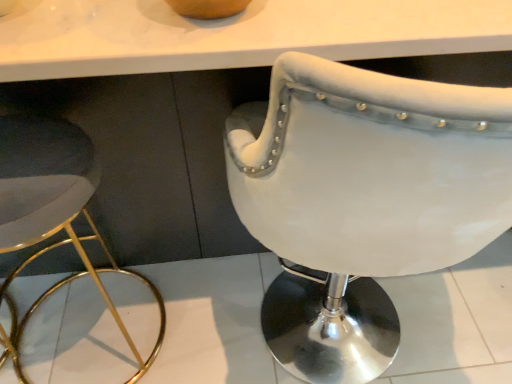
Question: Is white leather stool at left aimed at white leather chair at center?

Choices:
 (A) yes
 (B) no

Answer: (B)

Question: Considering the relative sizes of white leather stool at left and white leather chair at center in the image provided, is white leather stool at left wider than white leather chair at center?

Choices:
 (A) yes
 (B) no

Answer: (B)

Question: Is white leather chair at center located within white leather stool at left?

Choices:
 (A) yes
 (B) no

Answer: (B)

Question: Is white leather stool at left directly adjacent to white leather chair at center?

Choices:
 (A) yes
 (B) no

Answer: (B)

Question: Is white leather stool at left turned away from white leather chair at center?

Choices:
 (A) no
 (B) yes

Answer: (A)

Question: Can we say white leather stool at left lies outside white leather chair at center?

Choices:
 (A) no
 (B) yes

Answer: (B)

Question: Can you confirm if white leather chair at center is thinner than white leather stool at left?

Choices:
 (A) yes
 (B) no

Answer: (B)

Question: From a real-world perspective, is white leather chair at center on white leather stool at left?

Choices:
 (A) yes
 (B) no

Answer: (A)

Question: Does white leather chair at center have a greater width compared to white leather stool at left?

Choices:
 (A) no
 (B) yes

Answer: (B)

Question: Does white leather chair at center appear on the right side of white leather stool at left?

Choices:
 (A) no
 (B) yes

Answer: (B)

Question: Is white leather chair at center smaller than white leather stool at left?

Choices:
 (A) yes
 (B) no

Answer: (B)

Question: Is white leather stool at left completely or partially inside white leather chair at center?

Choices:
 (A) no
 (B) yes

Answer: (A)

Question: From the image's perspective, is white leather chair at center positioned above or below white leather stool at left?

Choices:
 (A) above
 (B) below

Answer: (A)